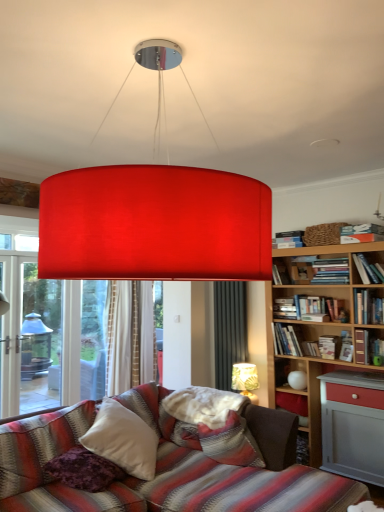
Question: Is point (360, 313) closer or farther from the camera than point (334, 340)?

Choices:
 (A) closer
 (B) farther

Answer: (A)

Question: Considering the positions of hardcover book at upper right, marked as the fifth book in a top-to-bottom arrangement, and hardcover book at upper right, positioned as the ninth book in top-to-bottom order, in the image, is hardcover book at upper right, marked as the fifth book in a top-to-bottom arrangement, bigger or smaller than hardcover book at upper right, positioned as the ninth book in top-to-bottom order,?

Choices:
 (A) big
 (B) small

Answer: (A)

Question: Estimate the real-world distances between objects in this image. Which object is farther from the hardcover book at right, the seventh book in the top-to-bottom sequence?

Choices:
 (A) hardcover book at upper right, placed as the second book when sorted from top to bottom
 (B) hardcover book at upper right, acting as the eighth book starting from the top
 (C) hardcover book at upper right, positioned as the 1th book in top-to-bottom order
 (D) matte gold lampshade at lower right, which is the second lamp from top to bottom
 (E) hardcover books at upper right, which is counted as the seventh book, starting from the bottom

Answer: (D)

Question: Estimate the real-world distances between objects in this image. Which object is farther from the hardcover book at upper right, which is counted as the sixth book, starting from the top?

Choices:
 (A) hardcover book at upper right, the 8th book ordered from the bottom
 (B) hardcover book at upper right, positioned as the ninth book in top-to-bottom order
 (C) white soft pillow at center, which is the 1th pillow from right to left
 (D) matte gold lampshade at lower right, which appears as the 1th lamp when viewed from the right
 (E) hardcover book at upper right, acting as the eighth book starting from the top

Answer: (C)